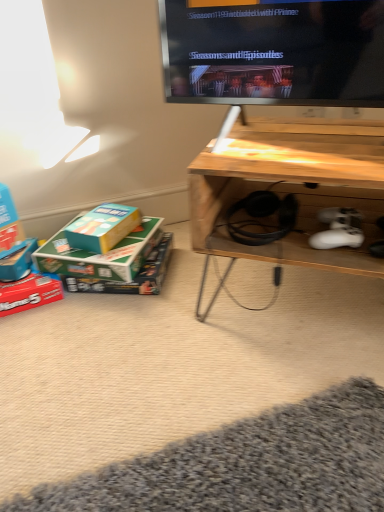
Where is `vacant space positioned to the left of wooden desk at lower right`? This screenshot has height=512, width=384. vacant space positioned to the left of wooden desk at lower right is located at coordinates click(149, 325).